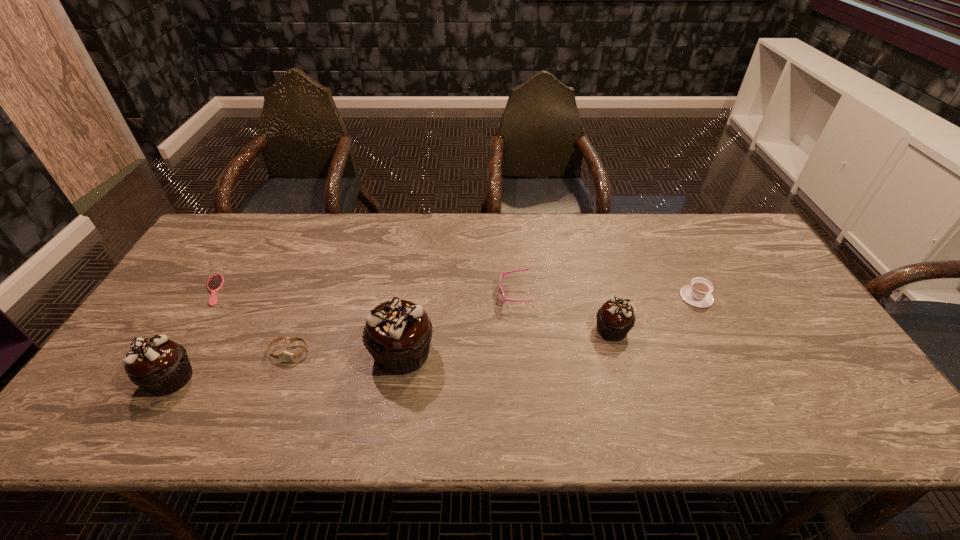
Locate an element on the screen. Image resolution: width=960 pixels, height=540 pixels. vacant space located on the front-facing side of the sunglasses is located at coordinates (460, 295).

You are a GUI agent. You are given a task and a screenshot of the screen. Output one action in this format:
    pyautogui.click(x=<x>, y=<y>)
    Task: Click on the cupcake that is at the left edge
    The image size is (960, 540).
    Given the screenshot: What is the action you would take?
    pyautogui.click(x=160, y=366)

Locate an element on the screen. hairbrush present at the left edge is located at coordinates (215, 282).

Identify the location of object positioned at the near left corner. (160, 366).

This screenshot has height=540, width=960. What are the coordinates of `vacant space at the far edge of the desktop` in the screenshot? It's located at tap(415, 233).

At what (x,y) coordinates should I click in order to perform the action: click on vacant region at the near edge of the desktop. Please return your answer as a coordinate pair (x, y). Looking at the image, I should click on (334, 397).

In the image, there is a desktop. Where is `free space at the left edge`? The image size is (960, 540). free space at the left edge is located at coordinates (194, 269).

I want to click on free space at the right edge of the desktop, so click(773, 313).

This screenshot has width=960, height=540. I want to click on vacant space at the far left corner, so (245, 239).

In the image, there is a desktop. Where is `vacant space at the far right corner`? vacant space at the far right corner is located at coordinates (708, 217).